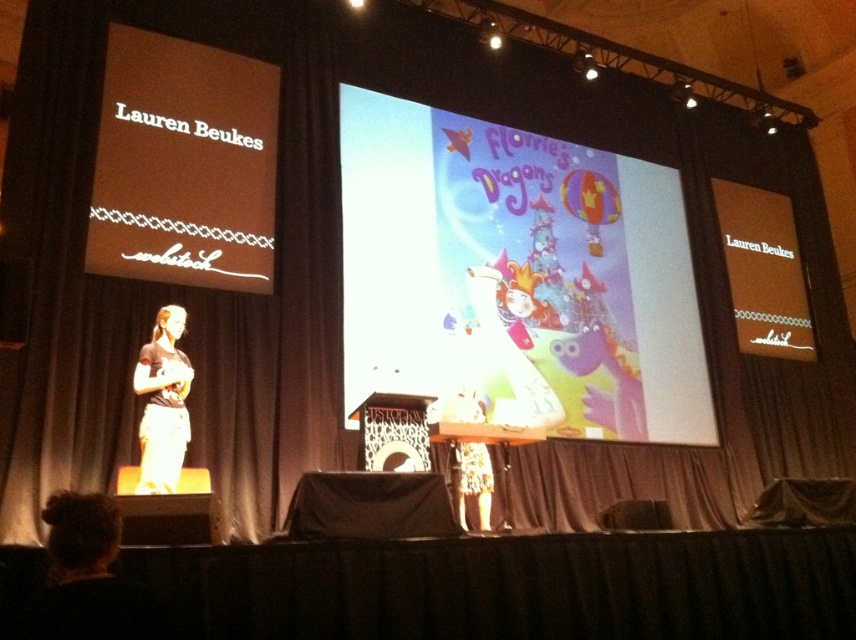
Question: Which object appears closest to the camera in this image?

Choices:
 (A) white textured dress at center
 (B) white cotton pants at lower left

Answer: (B)

Question: Observing the image, what is the correct spatial positioning of cartoonish paper-like poster at center in reference to white cotton pants at lower left?

Choices:
 (A) left
 (B) right

Answer: (B)

Question: Is cartoonish paper-like poster at center positioned before white textured dress at center?

Choices:
 (A) no
 (B) yes

Answer: (B)

Question: Which point appears farthest from the camera in this image?

Choices:
 (A) (635, 289)
 (B) (458, 442)
 (C) (153, 488)

Answer: (A)

Question: Which object appears farthest from the camera in this image?

Choices:
 (A) cartoonish paper-like poster at center
 (B) white cotton pants at lower left

Answer: (A)

Question: Does white cotton pants at lower left appear over white textured dress at center?

Choices:
 (A) no
 (B) yes

Answer: (B)